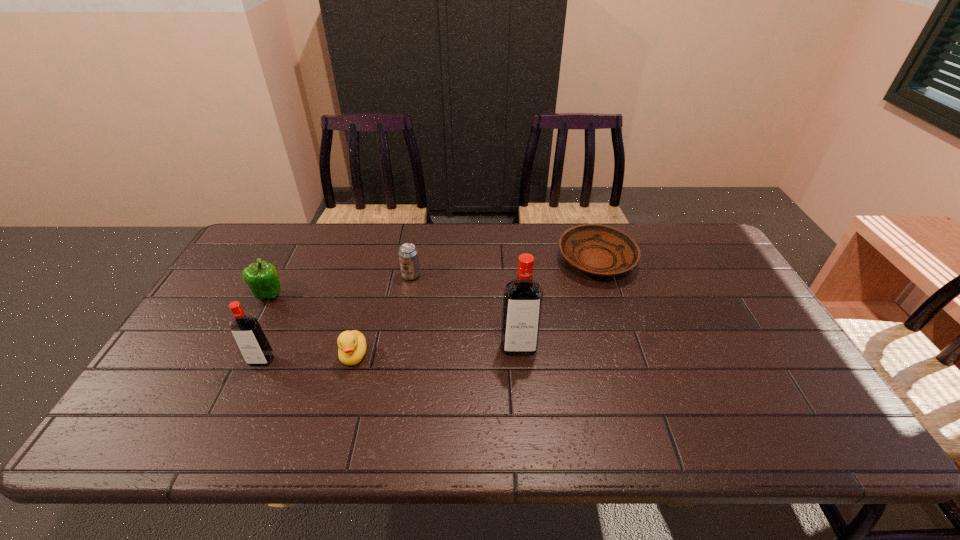
You are a GUI agent. You are given a task and a screenshot of the screen. Output one action in this format:
    pyautogui.click(x=<x>, y=<y>)
    Task: Click on the vacant space at the right edge of the desktop
    This screenshot has width=960, height=540.
    Given the screenshot: What is the action you would take?
    pyautogui.click(x=711, y=294)

Where is `blank space at the far left corner of the desktop`? This screenshot has width=960, height=540. blank space at the far left corner of the desktop is located at coordinates (299, 230).

This screenshot has width=960, height=540. Find the location of `vacant space in between the third tallest object and the plate`. vacant space in between the third tallest object and the plate is located at coordinates (433, 278).

Identify the location of unoccupied position between the bell pepper and the beer can. The image size is (960, 540). point(340,285).

At what (x,y) coordinates should I click in order to perform the action: click on vacant point located between the third tallest object and the shortest object. Please return your answer as a coordinate pair (x, y). The height and width of the screenshot is (540, 960). Looking at the image, I should click on (433, 278).

Where is `free point between the tallest object and the shortest object`? The height and width of the screenshot is (540, 960). free point between the tallest object and the shortest object is located at coordinates (558, 304).

Find the location of a particular element. The image size is (960, 540). unoccupied area between the left vodka and the rightmost object is located at coordinates (429, 310).

Where is `vacant space that is in between the fifth shortest object and the beer can`? vacant space that is in between the fifth shortest object and the beer can is located at coordinates (336, 318).

This screenshot has height=540, width=960. I want to click on vacant space that is in between the plate and the third shortest object, so click(504, 268).

Identify the location of free spot between the beer can and the fourth object from right to left. This screenshot has width=960, height=540. (382, 315).